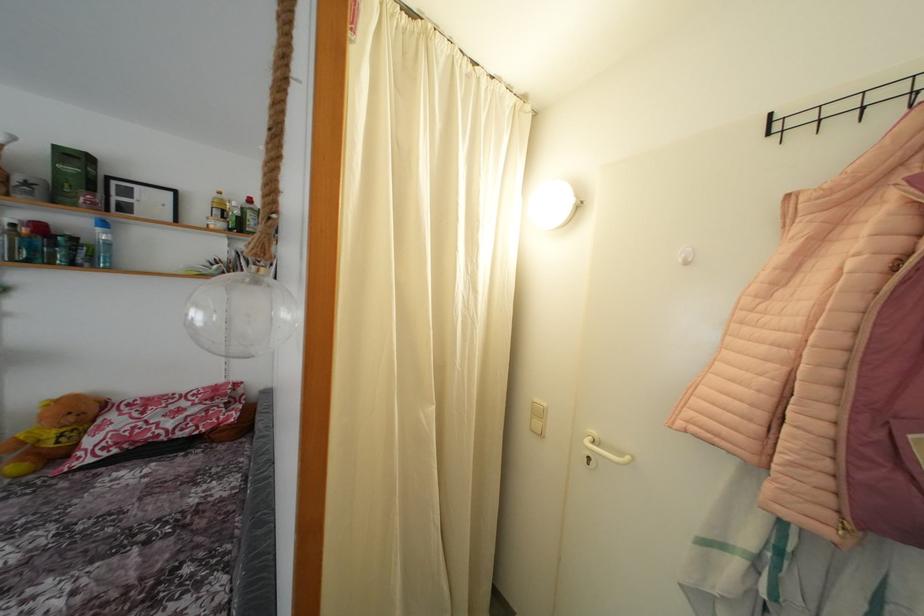
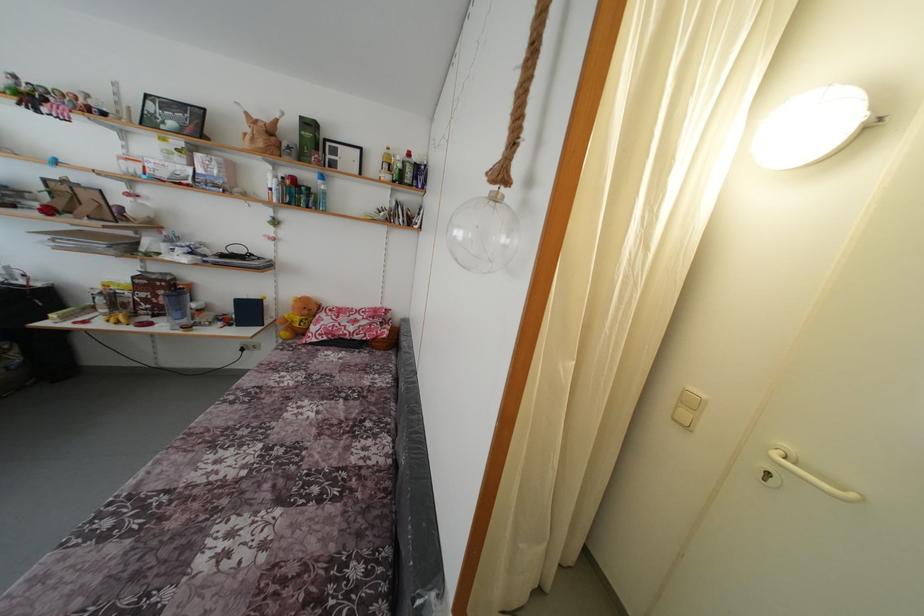
Locate, in the second image, the point that corresponds to point (126, 421) in the first image.

(332, 321)